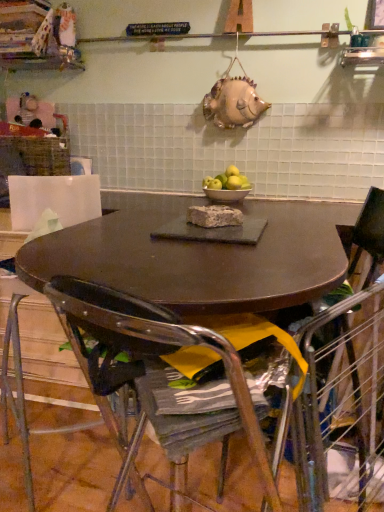
Image resolution: width=384 pixels, height=512 pixels. In order to click on space that is in front of brown crumbly cake at center in this screenshot , I will do `click(211, 242)`.